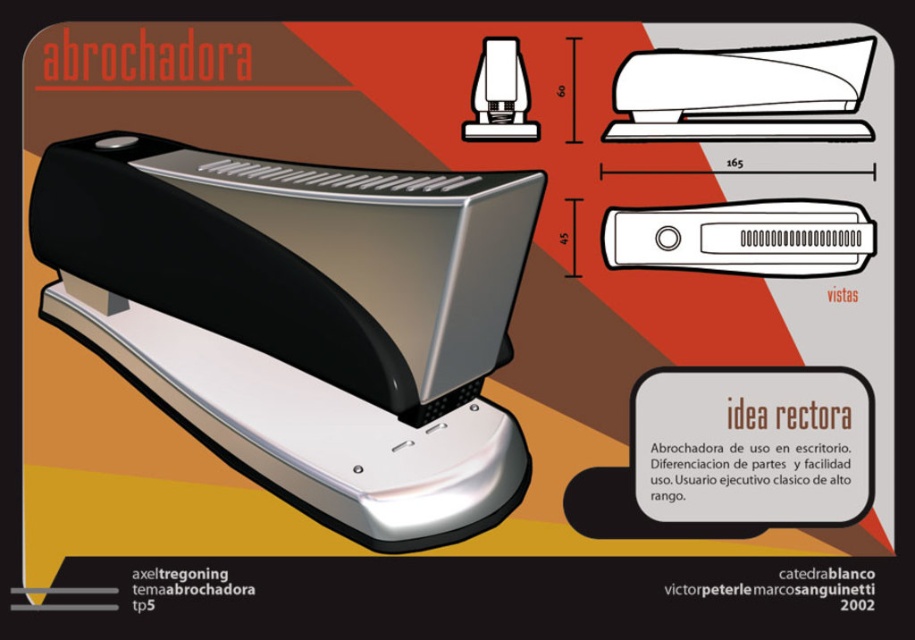
You are a delivery person who needs to place a white plastic stapler at center and a matte black stapler at upper center on a shelf that is 14 centimeters wide. Will both items fit side by side on the shelf without overlapping?

The white plastic stapler at center and matte black stapler at upper center are 13.51 centimeters apart from each other. Since the shelf is 14 centimeters wide, there is enough space for both items to fit side by side without overlapping.

Where is the matte black stapler at center located in the image?

The matte black stapler at center is located at point coordinates of (x=303, y=321).